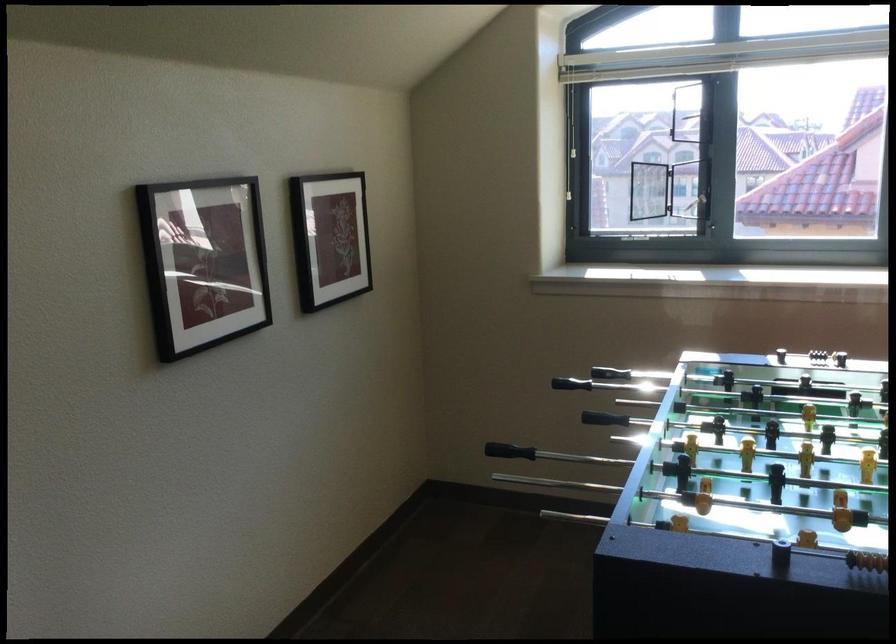
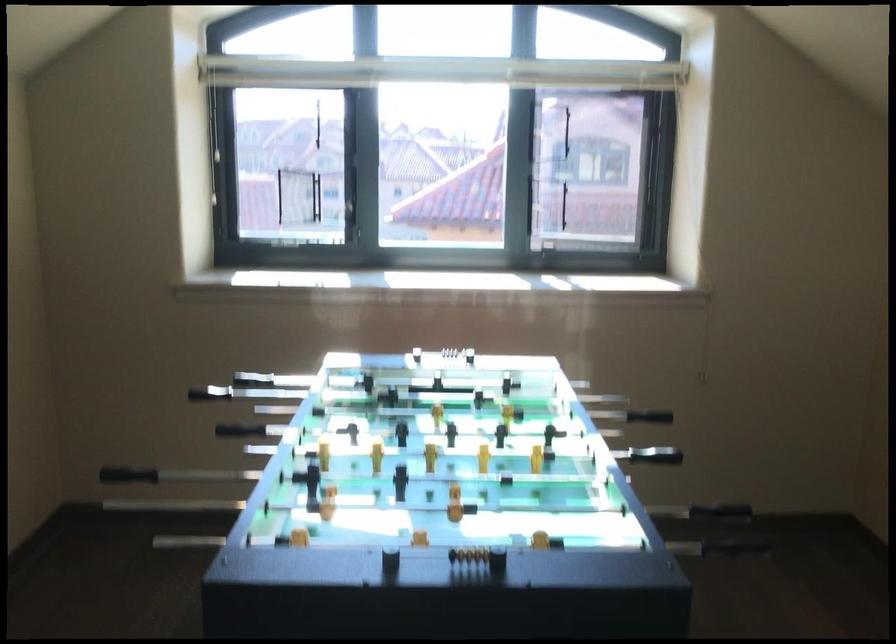
Question: The images are taken continuously from a first-person perspective. In which direction is your viewpoint rotating?

Choices:
 (A) Left
 (B) Right
 (C) Up
 (D) Down

Answer: (B)